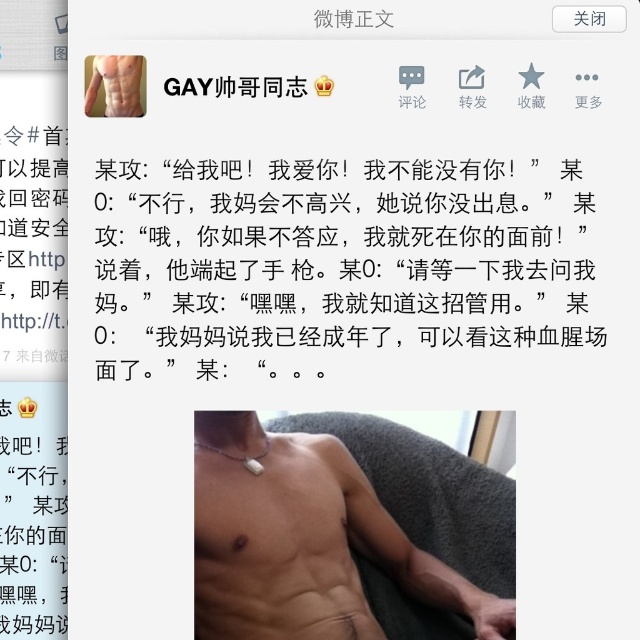
You are designing a layout for a social media post and need to ensure that the white matte text at upper center and the matte silver necklace at center are both visible. Based on their positions and sizes, which object might require more horizontal space?

The white matte text at upper center might be wider than the matte silver necklace at center, so it might require more horizontal space.